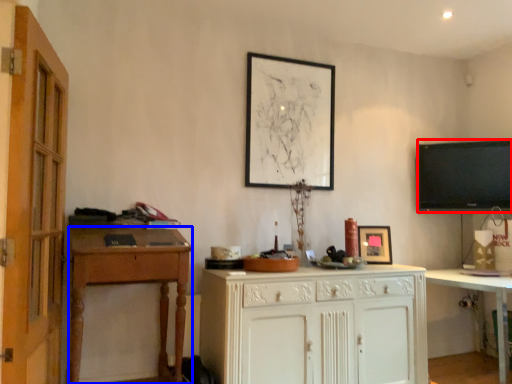
Question: Which object is closer to the camera taking this photo, television (highlighted by a red box) or desk (highlighted by a blue box)?

Choices:
 (A) television
 (B) desk

Answer: (B)